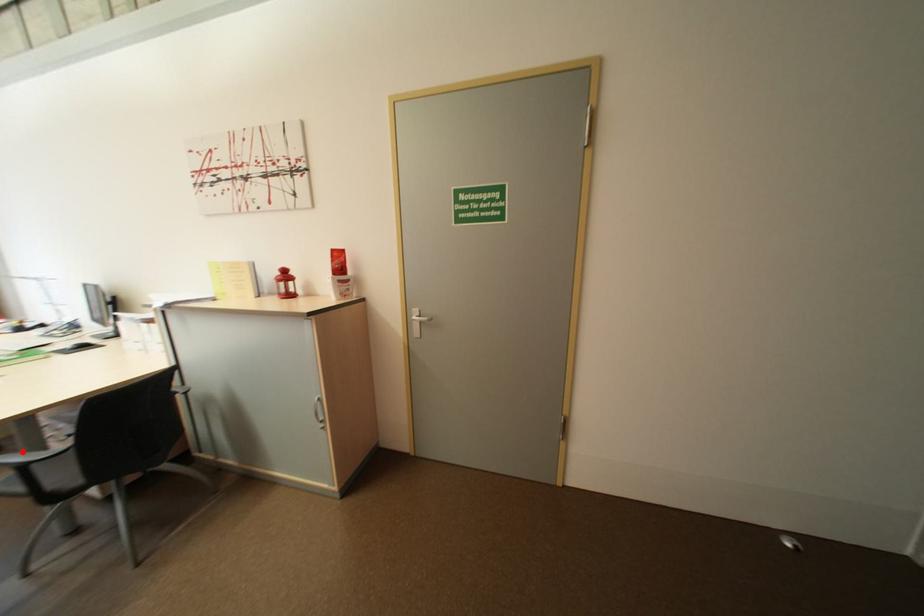
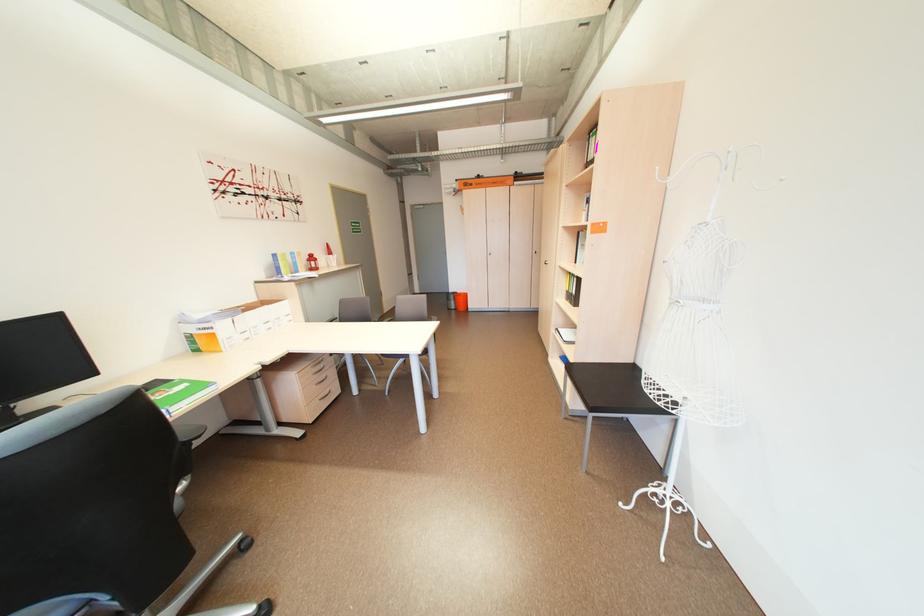
Question: I am providing you with two images of the same scene from different viewpoints. A red point is marked on the first image. Is the red point's position out of view in image 2?

Choices:
 (A) Yes
 (B) No

Answer: (A)